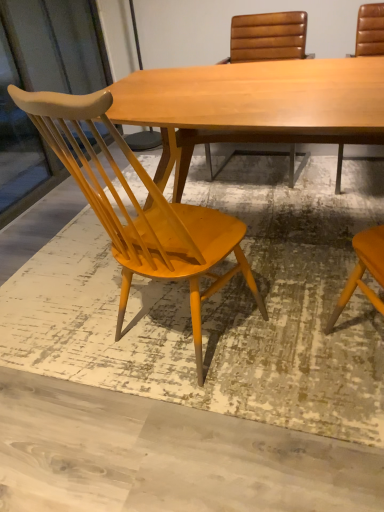
Question: In the image, is leather at right, which is the 1th chair from right to left, on the left side or the right side of matte wood screen door at left?

Choices:
 (A) right
 (B) left

Answer: (A)

Question: From a real-world perspective, is leather at right, which is the 1th chair from right to left, above or below matte wood screen door at left?

Choices:
 (A) below
 (B) above

Answer: (A)

Question: Estimate the real-world distances between objects in this image. Which object is closer to the matte wood screen door at left?

Choices:
 (A) leather at right, the third chair when ordered from left to right
 (B) matte yellow wood chair at left, marked as the 1th chair in a left-to-right arrangement
 (C) leather-like brown chair at upper center, placed as the second chair when sorted from right to left

Answer: (C)

Question: Which object is positioned farthest from the matte yellow wood chair at left, marked as the 1th chair in a left-to-right arrangement?

Choices:
 (A) matte wood screen door at left
 (B) leather-like brown chair at upper center, placed as the second chair when sorted from right to left
 (C) leather at right, which is the 1th chair from right to left

Answer: (A)